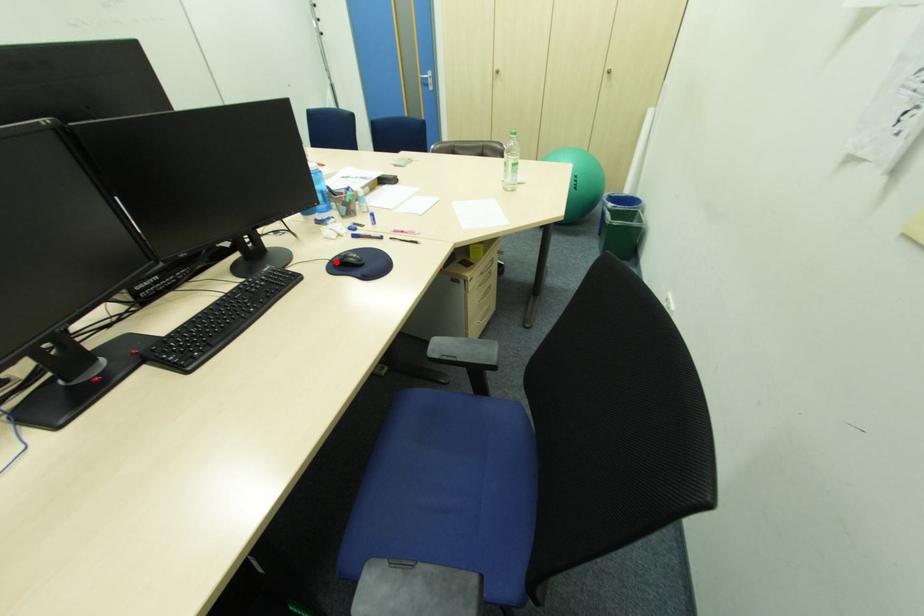
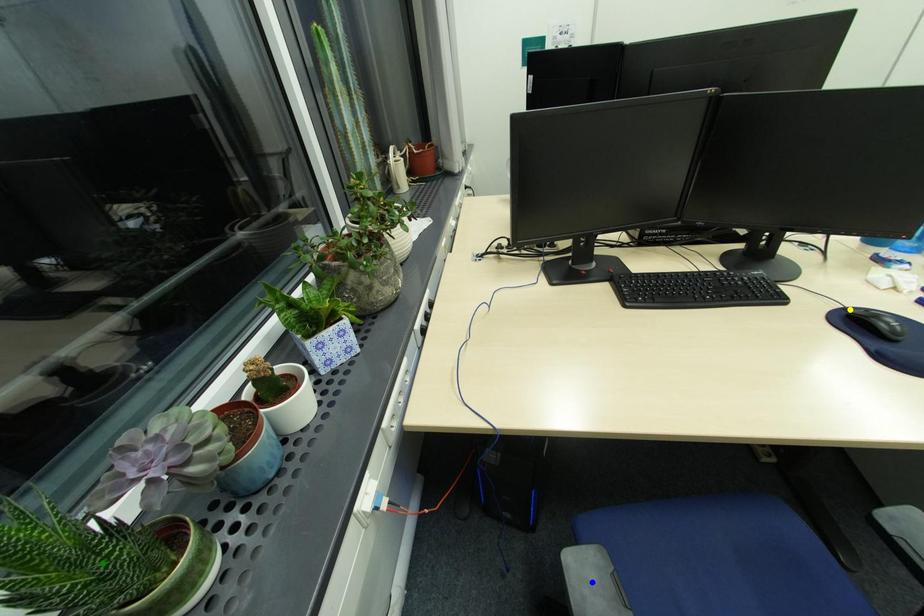
Question: I am providing you with two images of the same scene from different viewpoints. A red point is marked on the first image. You are given multiple points on the second image. Which point in image 2 is actually the same real-world point as the red point in image 1?

Choices:
 (A) yellow point
 (B) green point
 (C) blue point

Answer: (A)